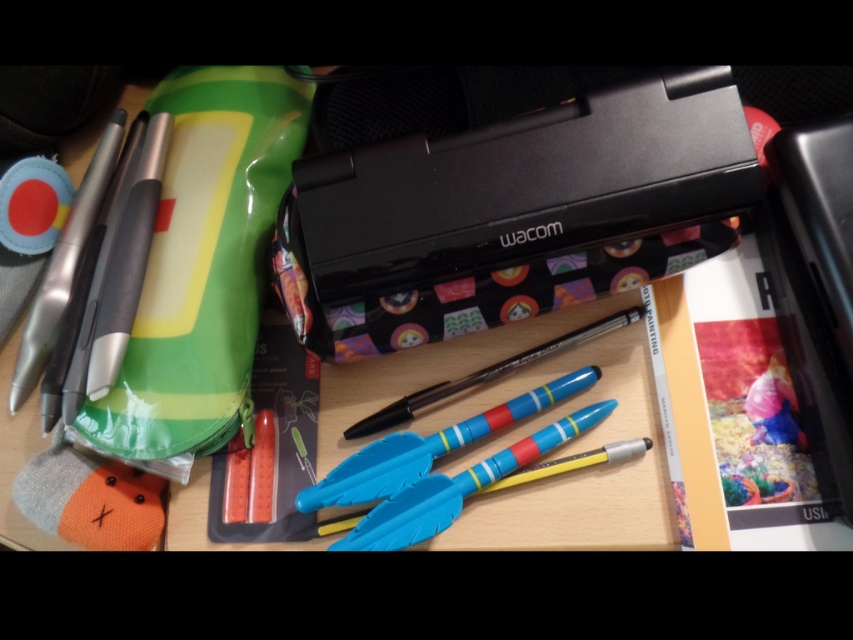
Who is lower down, black matte wacom case at center or matte plastic pens at center?

Positioned lower is matte plastic pens at center.

Is black matte wacom case at center shorter than matte plastic pens at center?

In fact, black matte wacom case at center may be taller than matte plastic pens at center.

Between point (367, 218) and point (552, 396), which one is positioned behind?

The point (552, 396) is more distant.

Find the location of a particular element. black matte wacom case at center is located at coordinates (511, 214).

Can you confirm if matte plastic pens at center is positioned above translucent plastic pen at center?

No, matte plastic pens at center is not above translucent plastic pen at center.

Does matte plastic pens at center appear on the left side of translucent plastic pen at center?

Correct, you'll find matte plastic pens at center to the left of translucent plastic pen at center.

Does point (498, 424) come behind point (488, 378)?

No, it is not.

I want to click on matte plastic pens at center, so tap(426, 448).

Between black matte wacom case at center and translucent plastic pen at center, which one appears on the left side from the viewer's perspective?

translucent plastic pen at center is more to the left.

Is black matte wacom case at center further to camera compared to translucent plastic pen at center?

No.

Is point (593, 145) positioned before point (438, 397)?

Yes, it is in front of point (438, 397).

Locate an element on the screen. black matte wacom case at center is located at coordinates (511, 214).